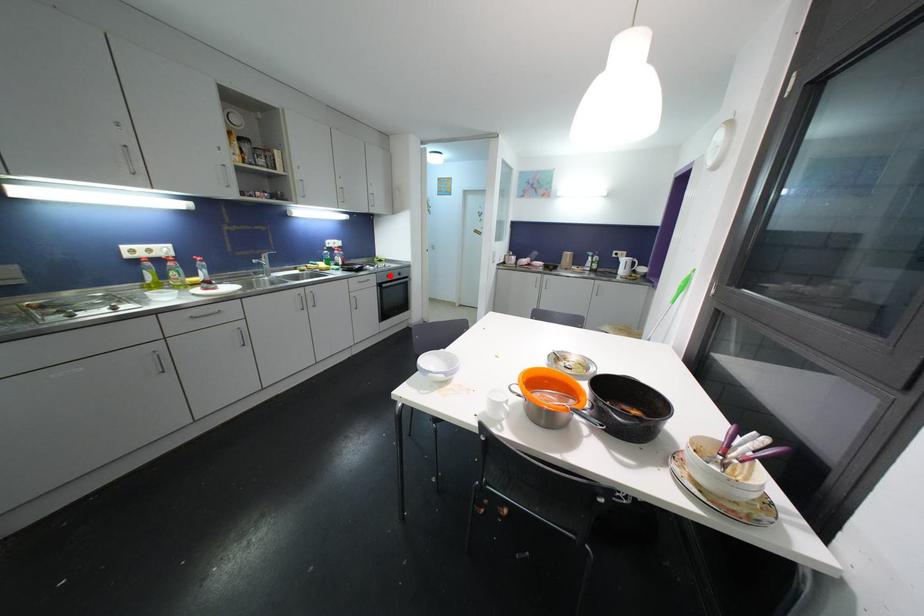
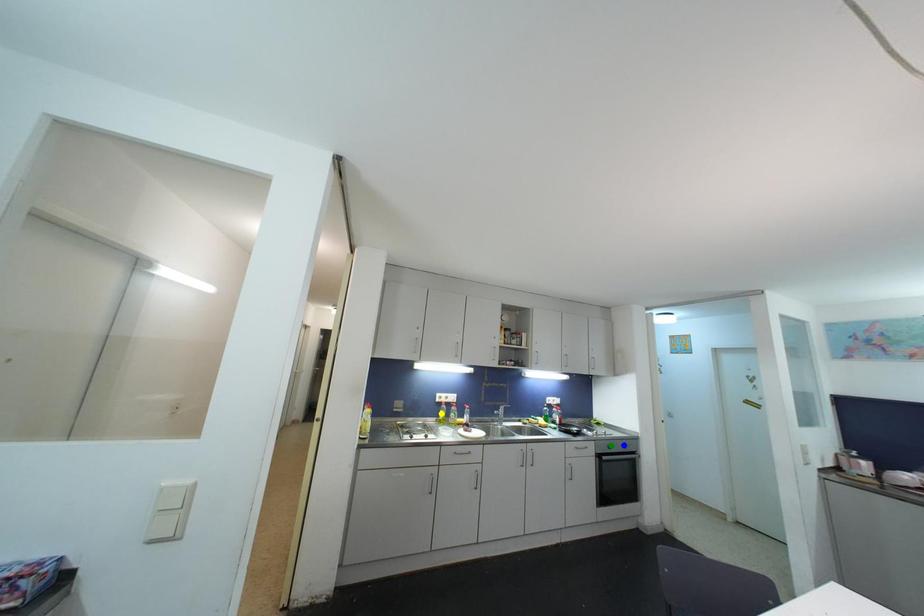
Question: I am providing you with two images of the same scene from different viewpoints. A red point is marked on the first image. You are given multiple points on the second image. Can you choose the point in image 2 that corresponds to the point in image 1?

Choices:
 (A) green point
 (B) yellow point
 (C) blue point

Answer: (A)